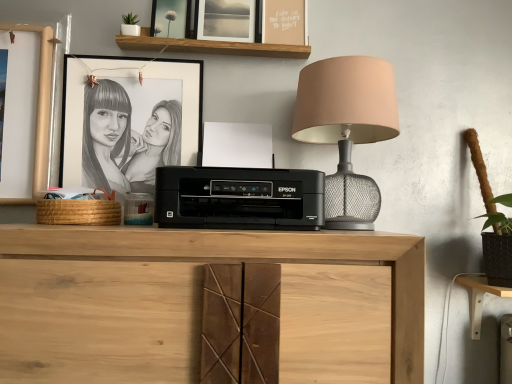
Find the location of a particular element. vacant area on top of wooden at upper center (from a real-world perspective) is located at coordinates (220, 38).